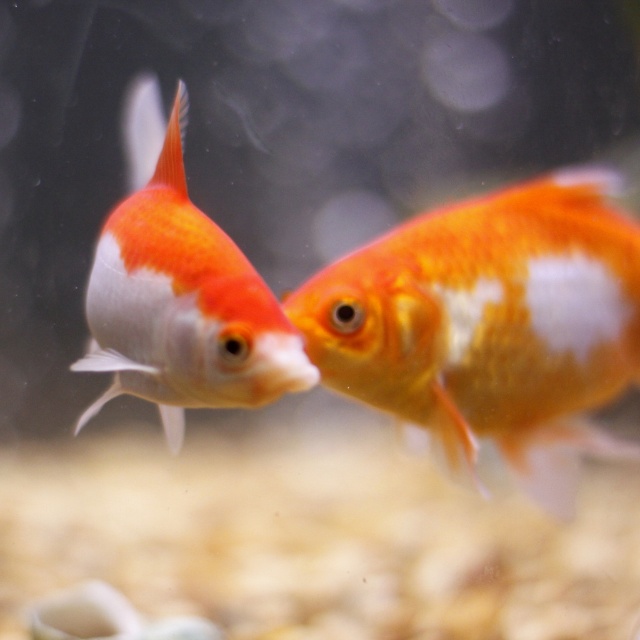
Can you confirm if shiny orange and white goldfish at center is positioned to the left of shiny orange and white fish at left?

In fact, shiny orange and white goldfish at center is to the right of shiny orange and white fish at left.

Who is taller, shiny orange and white goldfish at center or shiny orange and white fish at left?

shiny orange and white fish at left

The image size is (640, 640). What are the coordinates of `shiny orange and white goldfish at center` in the screenshot? It's located at (490, 324).